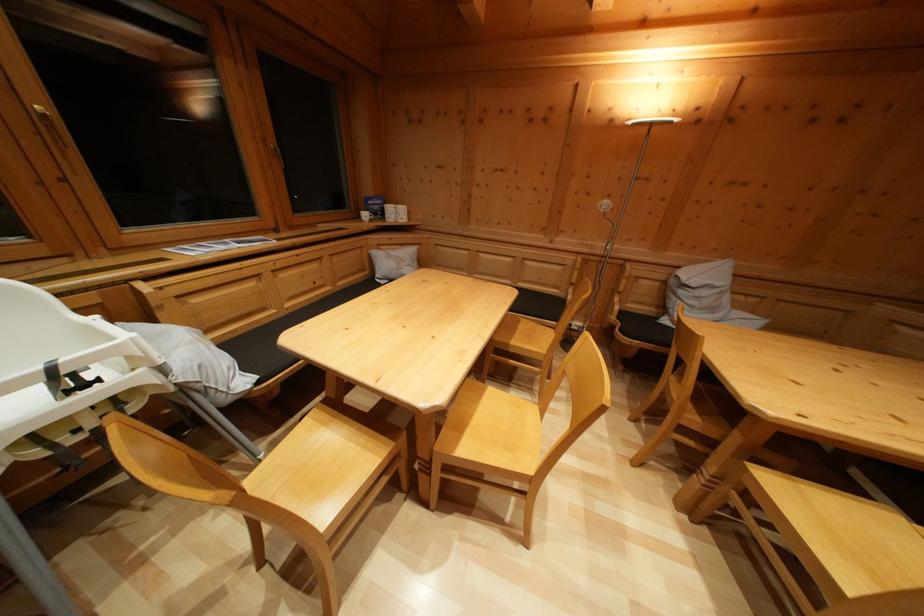
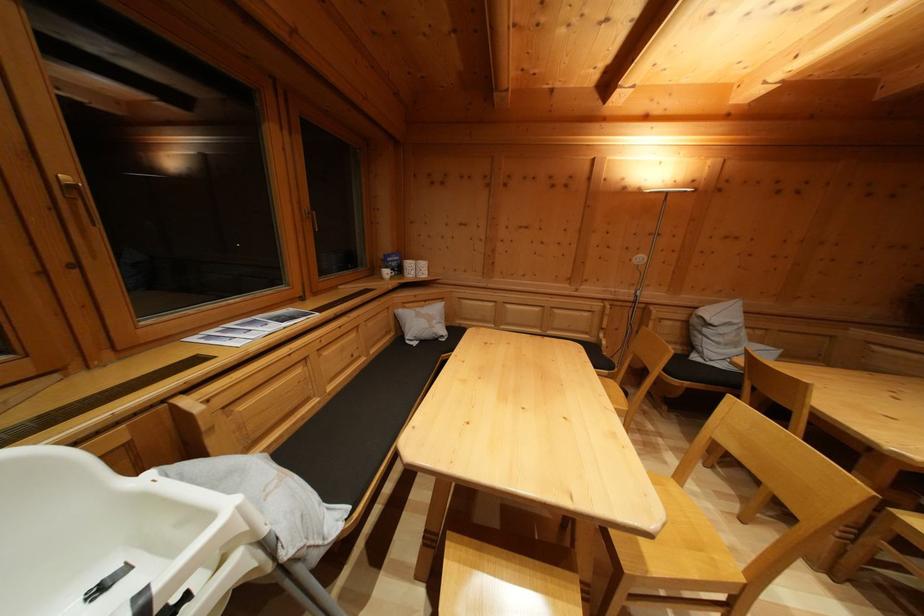
Question: The first image is from the beginning of the video and the second image is from the end. How did the camera likely rotate when shooting the video?

Choices:
 (A) Left
 (B) Right
 (C) Up
 (D) Down

Answer: (B)